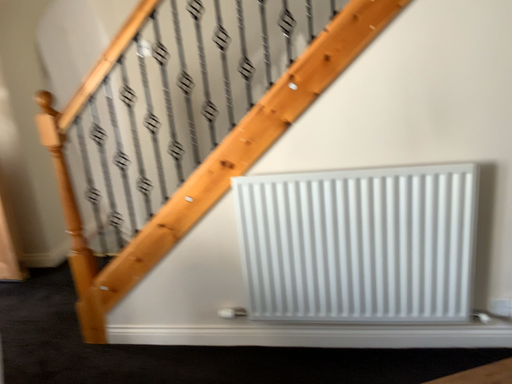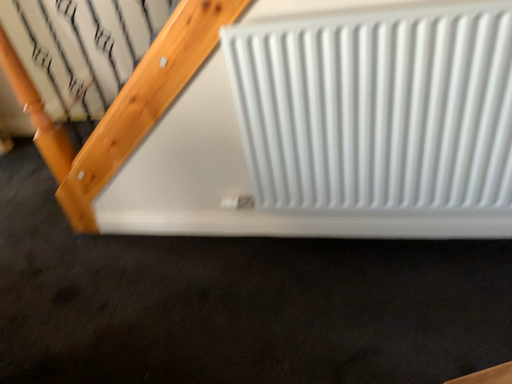
Question: How did the camera likely rotate when shooting the video?

Choices:
 (A) rotated upward
 (B) rotated downward

Answer: (B)